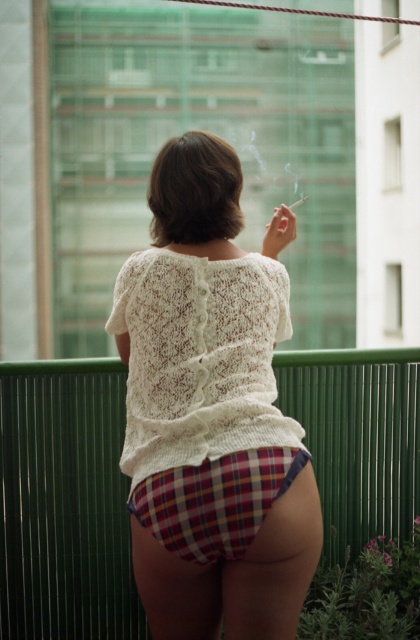
Question: Where is white knitted sweater at center located in relation to plaid fabric underwear at lower center in the image?

Choices:
 (A) right
 (B) left

Answer: (A)

Question: Which object is closer to the camera taking this photo?

Choices:
 (A) green metal fence at center
 (B) plaid fabric underwear at lower center
 (C) white knitted sweater at center

Answer: (B)

Question: Can you confirm if white knitted sweater at center is positioned below plaid fabric underwear at lower center?

Choices:
 (A) no
 (B) yes

Answer: (A)

Question: Which point is closer to the camera?

Choices:
 (A) (415, 352)
 (B) (288, 449)
 (C) (154, 305)

Answer: (B)

Question: Among these objects, which one is nearest to the camera?

Choices:
 (A) white knitted sweater at center
 (B) plaid fabric underwear at lower center

Answer: (B)

Question: Is white knitted sweater at center positioned at the back of plaid fabric underwear at lower center?

Choices:
 (A) no
 (B) yes

Answer: (B)